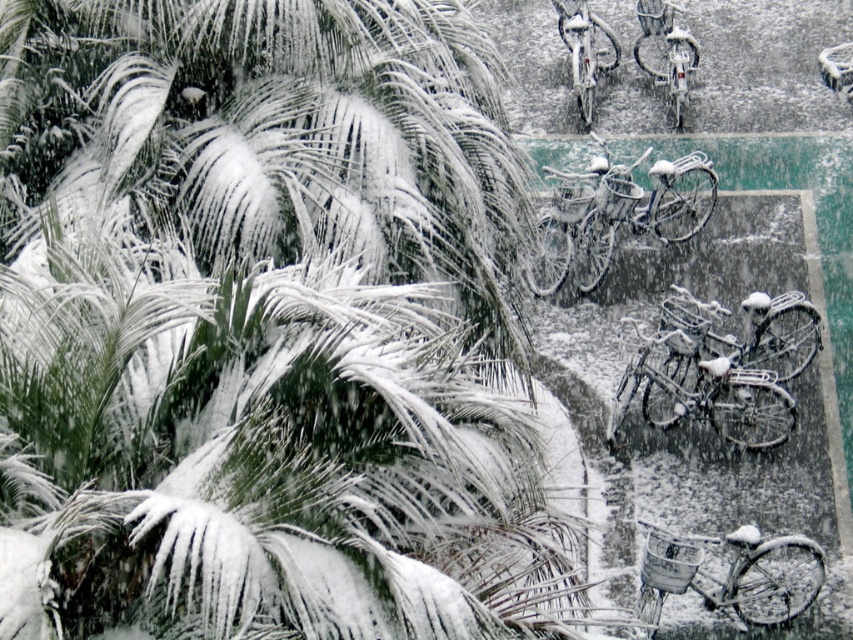
You are standing at the origin point of the coordinate system. You want to move towards the white frosty bicycle at center. What are the coordinates you need to move to reach it?

The white frosty bicycle at center is located at coordinates point (616, 214), so you need to move to that point to reach it.

From the picture: You are a delivery person trying to reach the metallic silver bicycle at upper right. There is another metallic silver bicycle at center blocking your path. Can you walk around it to get to the one you need?

The metallic silver bicycle at upper right is in front of the metallic silver bicycle at center, so you can walk around the metallic silver bicycle at center to reach the one in front.

You are standing in the snowy scene and want to take a photo of the metallic silver bicycle at upper right. Considering the distance, would you need to use a zoom lens to capture it clearly?

The metallic silver bicycle at upper right is 23.15 meters away from the camera. To capture it clearly from that distance, you would need to use a zoom lens.